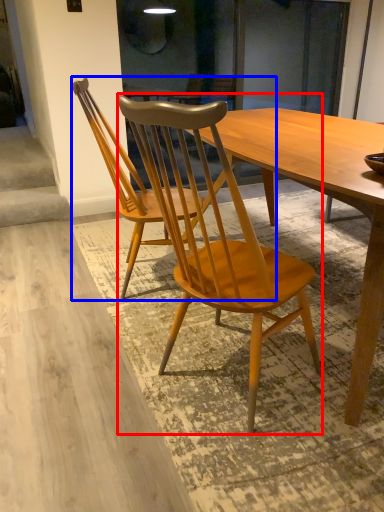
Question: Among these objects, which one is nearest to the camera, chair (highlighted by a red box) or chair (highlighted by a blue box)?

Choices:
 (A) chair
 (B) chair

Answer: (A)